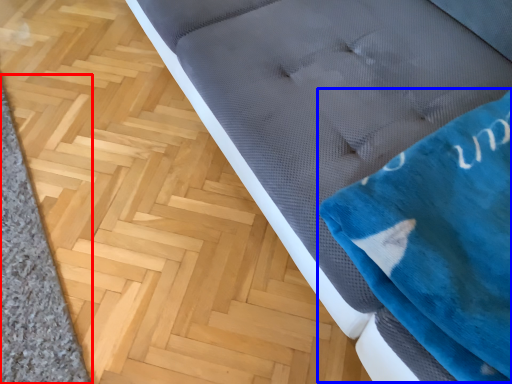
Question: Which object is further to the camera taking this photo, doormat (highlighted by a red box) or cloth (highlighted by a blue box)?

Choices:
 (A) doormat
 (B) cloth

Answer: (A)